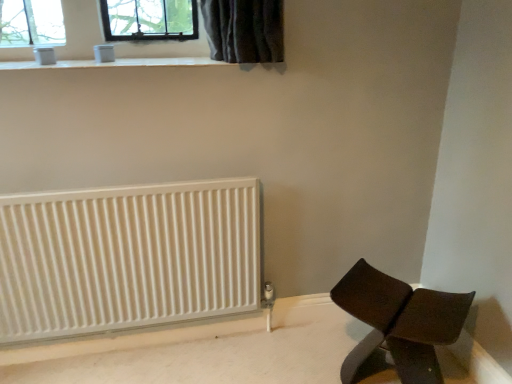
Question: Considering the relative positions of brown leather chair at lower right and white smooth window sill at upper center in the image provided, is brown leather chair at lower right to the right of white smooth window sill at upper center from the viewer's perspective?

Choices:
 (A) no
 (B) yes

Answer: (B)

Question: Can you confirm if brown leather chair at lower right is bigger than white smooth window sill at upper center?

Choices:
 (A) no
 (B) yes

Answer: (B)

Question: Is brown leather chair at lower right to the left of white smooth window sill at upper center from the viewer's perspective?

Choices:
 (A) yes
 (B) no

Answer: (B)

Question: From a real-world perspective, is brown leather chair at lower right below white smooth window sill at upper center?

Choices:
 (A) no
 (B) yes

Answer: (B)

Question: Is white smooth window sill at upper center inside brown leather chair at lower right?

Choices:
 (A) yes
 (B) no

Answer: (B)

Question: Does brown leather chair at lower right have a lesser width compared to white smooth window sill at upper center?

Choices:
 (A) yes
 (B) no

Answer: (A)

Question: Is white smooth window sill at upper center taller than white ribbed radiator at lower left?

Choices:
 (A) yes
 (B) no

Answer: (B)

Question: From a real-world perspective, is white smooth window sill at upper center located beneath white ribbed radiator at lower left?

Choices:
 (A) yes
 (B) no

Answer: (B)

Question: Is white smooth window sill at upper center at the right side of white ribbed radiator at lower left?

Choices:
 (A) no
 (B) yes

Answer: (B)

Question: From a real-world perspective, is white smooth window sill at upper center located higher than white ribbed radiator at lower left?

Choices:
 (A) yes
 (B) no

Answer: (A)

Question: Is there a large distance between white smooth window sill at upper center and white ribbed radiator at lower left?

Choices:
 (A) yes
 (B) no

Answer: (B)

Question: Are white smooth window sill at upper center and white ribbed radiator at lower left beside each other?

Choices:
 (A) yes
 (B) no

Answer: (B)

Question: Is brown leather chair at lower right not within white ribbed radiator at lower left?

Choices:
 (A) yes
 (B) no

Answer: (A)